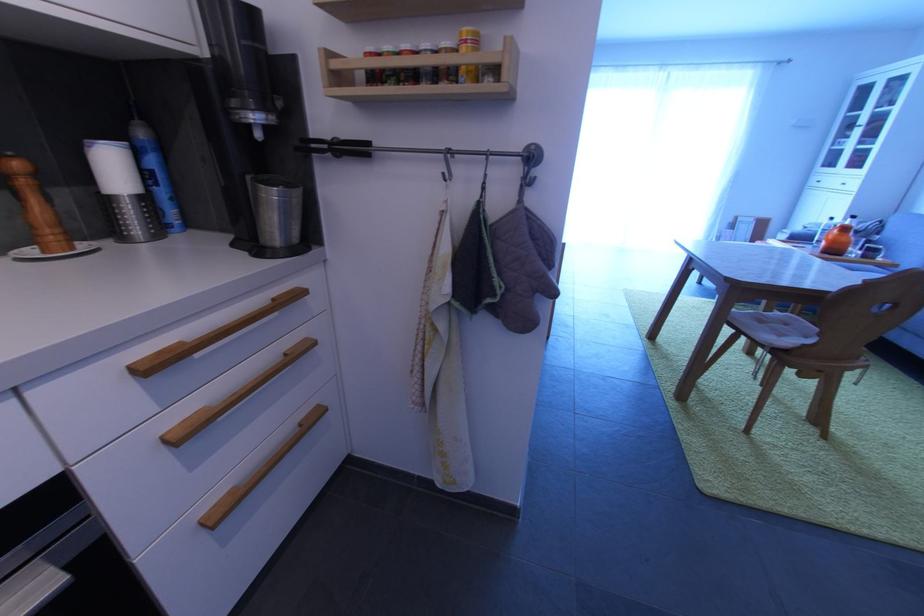
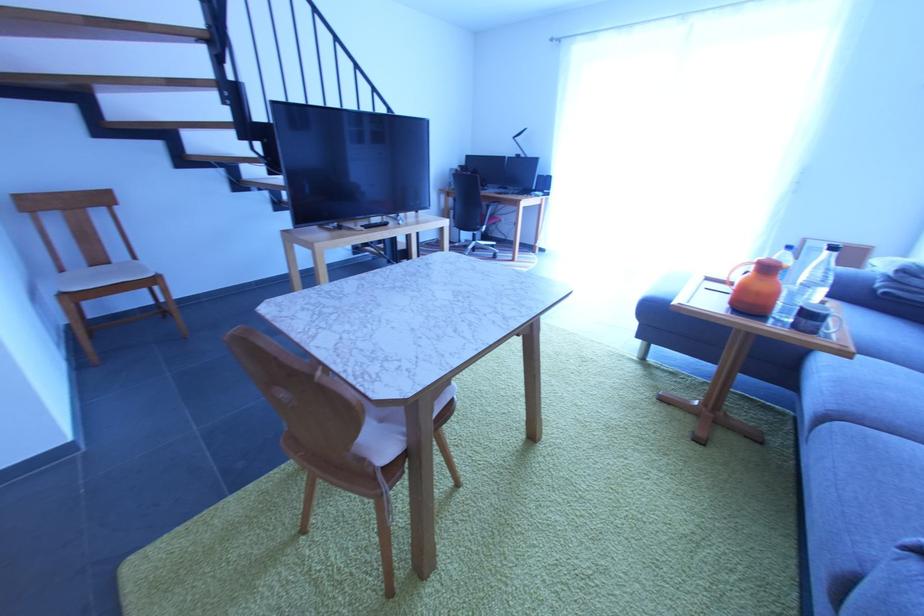
Locate, in the second image, the point that corresponds to pixel 880 261 in the first image.

(819, 334)